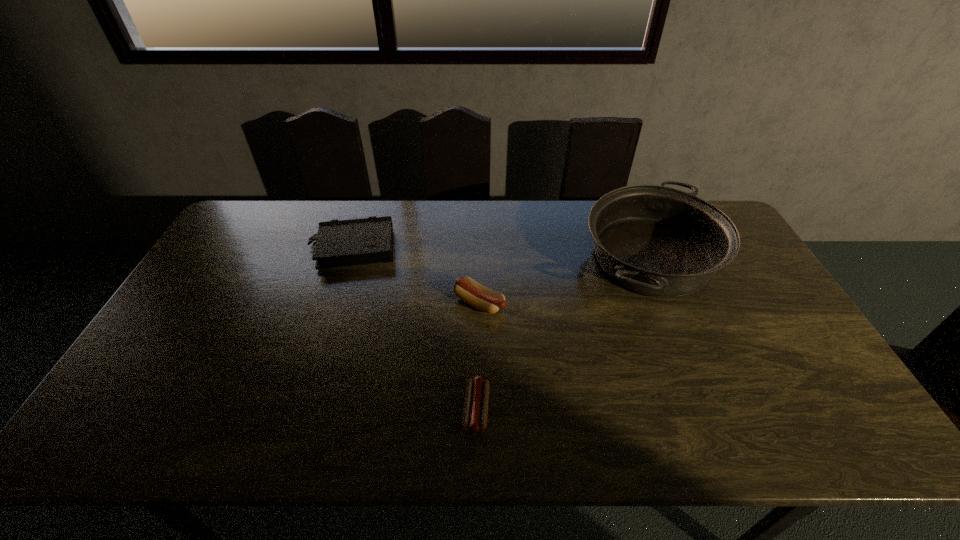
You are a GUI agent. You are given a task and a screenshot of the screen. Output one action in this format:
    pyautogui.click(x=<x>, y=<y>)
    Task: Click on the tallest object
    
    Given the screenshot: What is the action you would take?
    pyautogui.click(x=658, y=241)

Locate an element on the screen. pan is located at coordinates (658, 241).

Where is `the leftmost object`? The image size is (960, 540). the leftmost object is located at coordinates (369, 240).

Locate an element on the screen. the farther sausage is located at coordinates (478, 296).

The width and height of the screenshot is (960, 540). What are the coordinates of `the shorter sausage` in the screenshot? It's located at (475, 413).

At what (x,y) coordinates should I click in order to perform the action: click on the nearest object. Please return your answer as a coordinate pair (x, y). The height and width of the screenshot is (540, 960). Looking at the image, I should click on (475, 413).

What are the coordinates of `free point located on the left of the pan` in the screenshot? It's located at (537, 259).

The height and width of the screenshot is (540, 960). Find the location of `vacant area situated 0.370m on the right of the leftmost object`. vacant area situated 0.370m on the right of the leftmost object is located at coordinates (508, 248).

Identify the location of free location located on the front of the taller sausage. The height and width of the screenshot is (540, 960). (479, 418).

At what (x,y) coordinates should I click in order to perform the action: click on free space located 0.130m on the right of the nearer sausage. Please return your answer as a coordinate pair (x, y). Looking at the image, I should click on (544, 410).